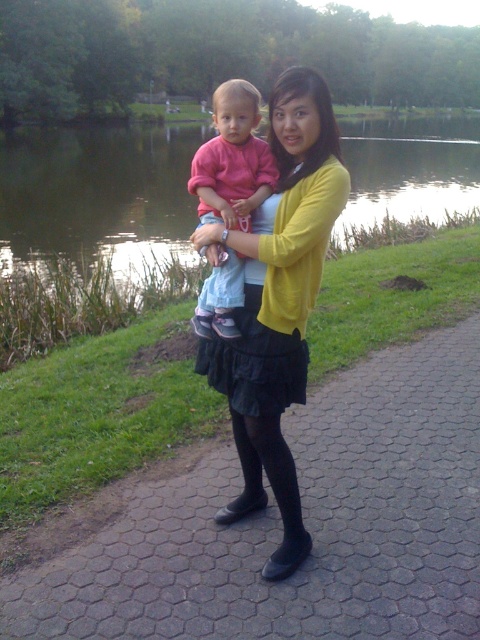
Question: Does black tights at center have a smaller size compared to glossy water at center?

Choices:
 (A) no
 (B) yes

Answer: (B)

Question: Which object is farther from the camera taking this photo?

Choices:
 (A) black tights at center
 (B) matte pink shirt at center

Answer: (B)

Question: Which is farther from the yellow matte sweater at center?

Choices:
 (A) matte pink shirt at center
 (B) black tights at center
 (C) glossy water at center

Answer: (C)

Question: Does black tights at center have a larger size compared to glossy water at center?

Choices:
 (A) yes
 (B) no

Answer: (B)

Question: Which point appears farthest from the camera in this image?

Choices:
 (A) (216, 202)
 (B) (36, 176)
 (C) (442, 429)
 (D) (274, 125)

Answer: (B)

Question: Is yellow matte sweater at center bigger than matte pink shirt at center?

Choices:
 (A) yes
 (B) no

Answer: (A)